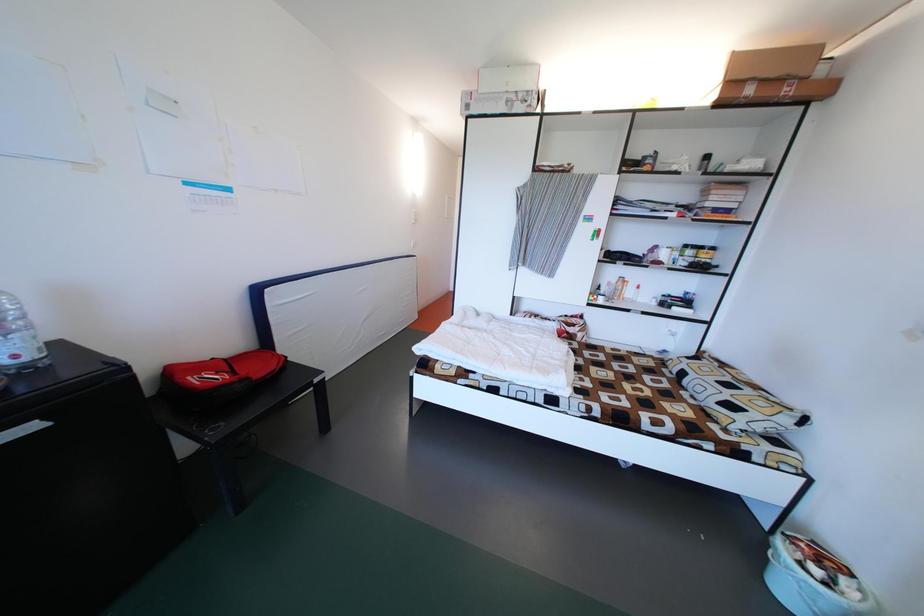
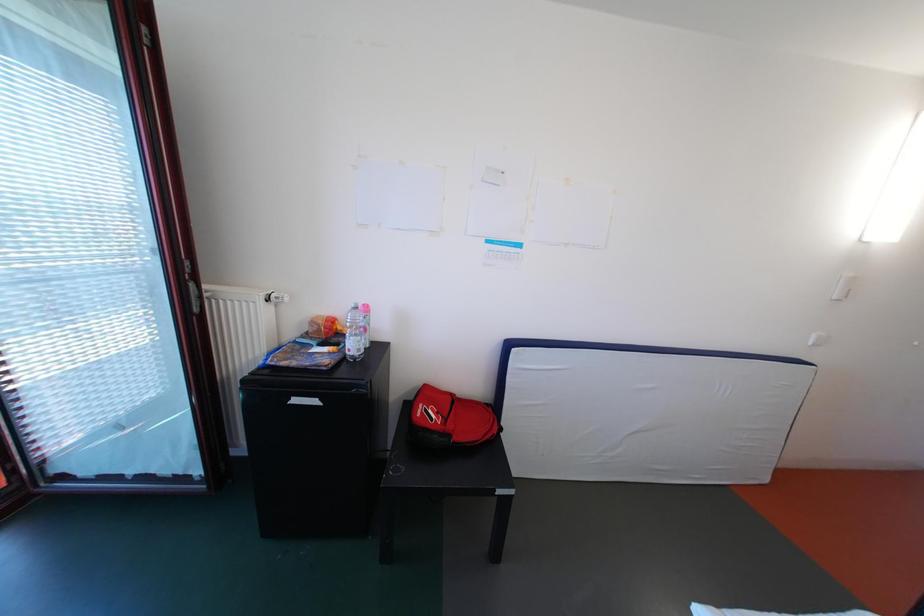
Question: The camera is either moving clockwise (left) or counter-clockwise (right) around the object. The first image is from the beginning of the video and the second image is from the end. Is the camera moving left or right when shooting the video?

Choices:
 (A) Left
 (B) Right

Answer: (B)